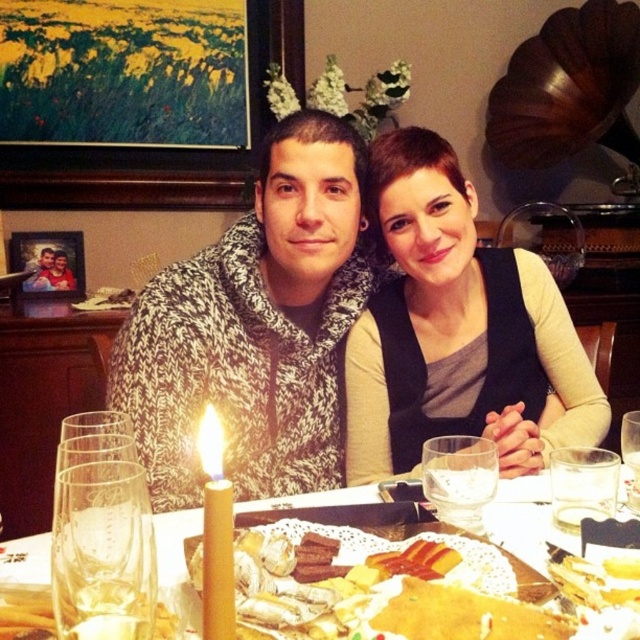
Question: Can you confirm if clear glass wine glass at lower left is bigger than clear glass wine glass at center?

Choices:
 (A) yes
 (B) no

Answer: (B)

Question: Which object is positioned closest to the clear glass wine glass at lower left?

Choices:
 (A) transparent glass at table center
 (B) translucent glass plate at center
 (C) brushed metal picture frame at upper center
 (D) wooden photo frame at upper left

Answer: (B)

Question: Can you confirm if matte black vest at center is positioned above transparent glass at table center?

Choices:
 (A) no
 (B) yes

Answer: (B)

Question: Which point is farther to the camera?

Choices:
 (A) (204, 465)
 (B) (509, 296)
 (C) (131, 176)
 (D) (276, 397)

Answer: (C)

Question: Among these objects, which one is nearest to the camera?

Choices:
 (A) clear glass wine glass at center
 (B) wooden photo frame at upper left
 (C) transparent glass at table center

Answer: (C)

Question: Where is clear glass wine glass at lower left located in relation to transparent glass at table center in the image?

Choices:
 (A) right
 (B) left

Answer: (B)